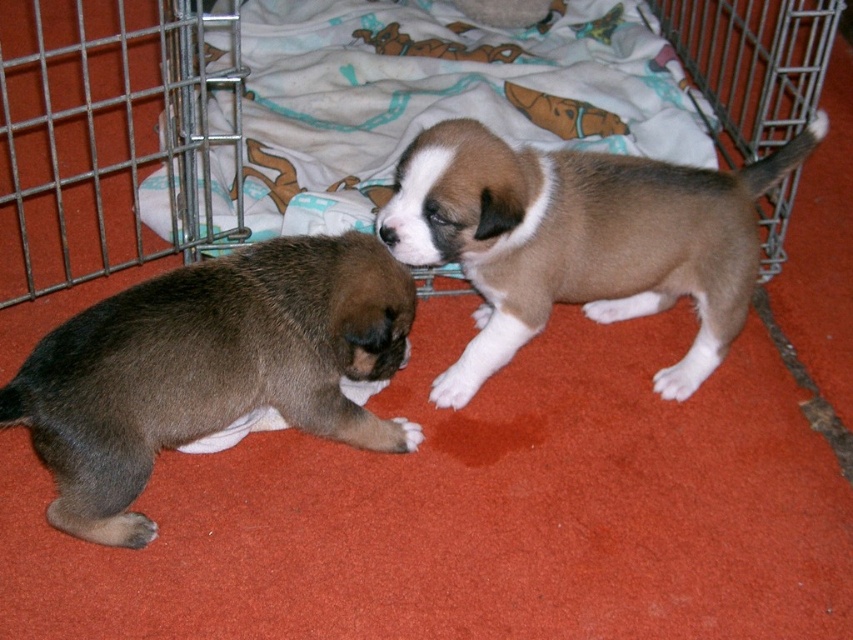
Question: Among these objects, which one is nearest to the camera?

Choices:
 (A) brown fur puppy at center
 (B) metal wire cage at upper left

Answer: (B)

Question: In this image, where is brown fur puppy at center located relative to metal wire cage at upper left?

Choices:
 (A) right
 (B) left

Answer: (A)

Question: Can you confirm if brown fuzzy puppy at lower left is smaller than metal wire cage at upper left?

Choices:
 (A) no
 (B) yes

Answer: (B)

Question: Which of the following is the closest to the observer?

Choices:
 (A) (283, 240)
 (B) (657, 259)
 (C) (39, 204)

Answer: (A)

Question: Is brown fur puppy at center positioned before metal wire cage at upper left?

Choices:
 (A) no
 (B) yes

Answer: (A)

Question: Which object is closer to the camera taking this photo?

Choices:
 (A) brown fur puppy at center
 (B) metal wire cage at upper left

Answer: (B)